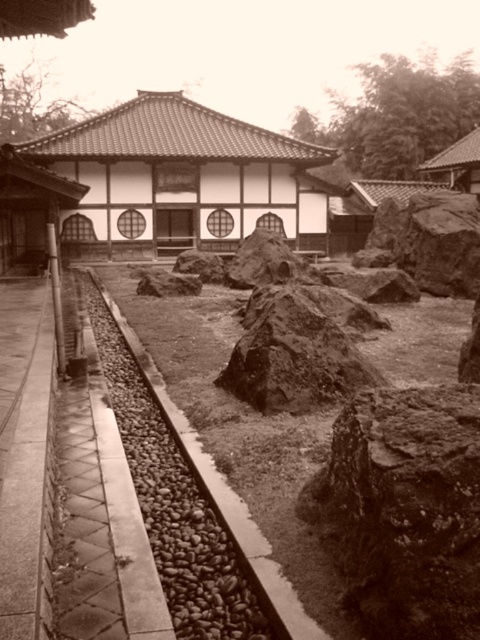
Question: Estimate the real-world distances between objects in this image. Which object is farther from the rusty rock at center?

Choices:
 (A) rustic brown rock at center
 (B) smooth stone train track at center

Answer: (A)

Question: Considering the relative positions of rusty rock at center and smooth stone train track at center in the image provided, where is rusty rock at center located with respect to smooth stone train track at center?

Choices:
 (A) right
 (B) left

Answer: (A)

Question: Can you confirm if rusty rock at center is bigger than rustic brown rock at center?

Choices:
 (A) yes
 (B) no

Answer: (B)

Question: Which point appears farthest from the camera in this image?

Choices:
 (A) (472, 451)
 (B) (142, 483)
 (C) (300, 372)

Answer: (C)

Question: Estimate the real-world distances between objects in this image. Which object is closer to the rustic brown rock at center?

Choices:
 (A) rusty rock at center
 (B) smooth stone train track at center

Answer: (B)

Question: Is smooth stone train track at center further to camera compared to rustic brown rock at center?

Choices:
 (A) no
 (B) yes

Answer: (A)